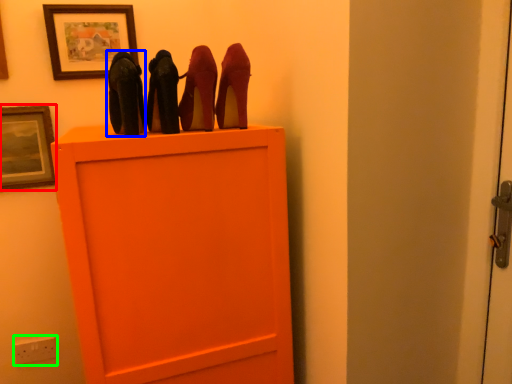
Question: Which object is the closest to the picture frame (highlighted by a red box)? Choose among these: high heels (highlighted by a blue box) or electric outlet (highlighted by a green box).

Choices:
 (A) high heels
 (B) electric outlet

Answer: (A)